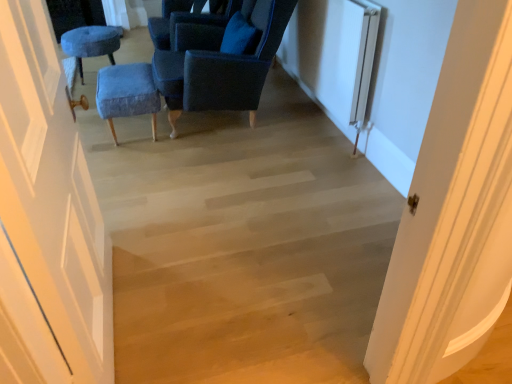
You are a GUI agent. You are given a task and a screenshot of the screen. Output one action in this format:
    pyautogui.click(x=<x>, y=<y>)
    Task: Click on the free location in front of velvet blue ottoman at center, which appears as the first furniture when viewed from the right
    The width and height of the screenshot is (512, 384).
    Given the screenshot: What is the action you would take?
    [x=130, y=162]